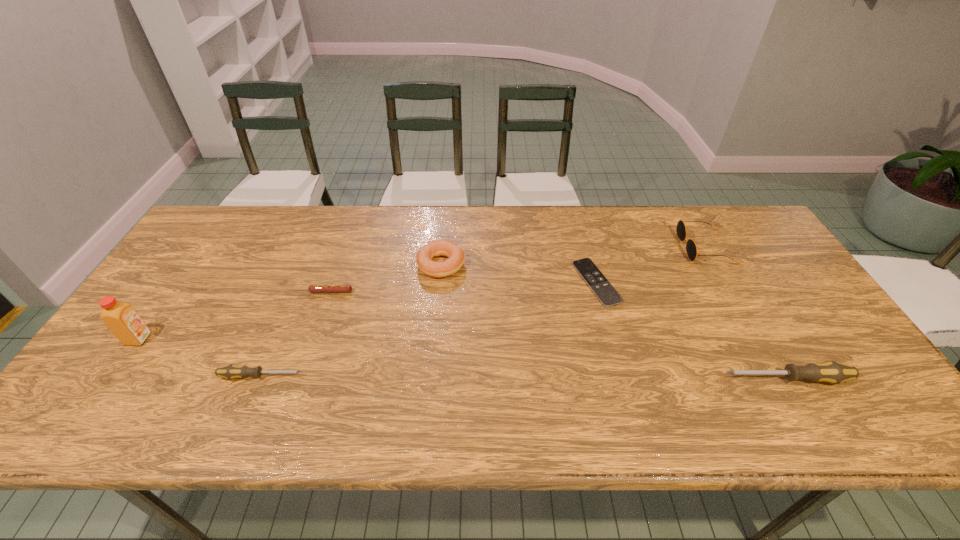
You are a GUI agent. You are given a task and a screenshot of the screen. Output one action in this format:
    pyautogui.click(x=<x>, y=<y>)
    Task: Click on the vacant spot for a new screwdriver to ensure equal spacing
    The width and height of the screenshot is (960, 540).
    Given the screenshot: What is the action you would take?
    coord(523,377)